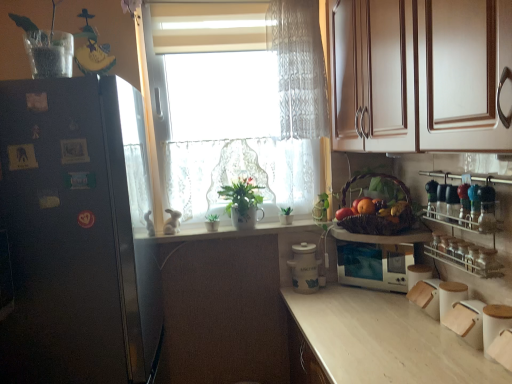
Locate an element on the screen. This screenshot has width=512, height=384. vacant area situated to the left side of green matte houseplant at center, which is counted as the third houseplant, starting from the left is located at coordinates (260, 226).